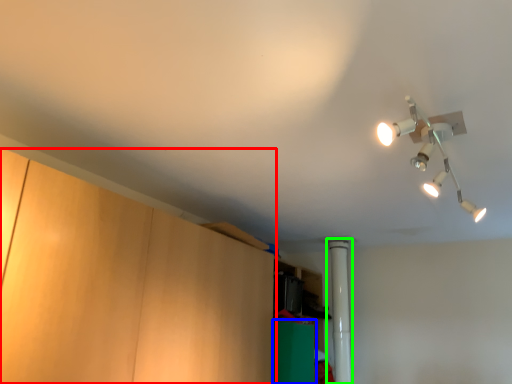
Question: Which object is the farthest from cabinetry (highlighted by a red box)? Choose among these: cabinetry (highlighted by a blue box) or pipe (highlighted by a green box).

Choices:
 (A) cabinetry
 (B) pipe

Answer: (B)